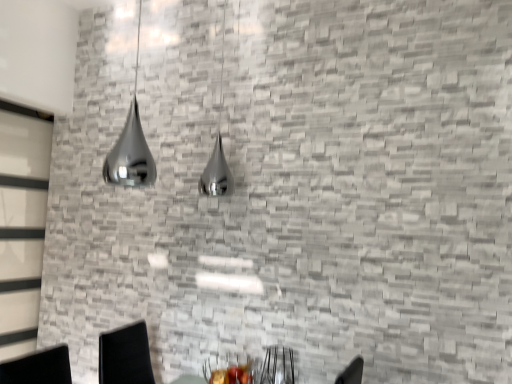
Question: Would you say shiny metallic lamp at upper left contains clear glass door at left?

Choices:
 (A) yes
 (B) no

Answer: (B)

Question: Is shiny metallic lamp at upper left positioned behind clear glass door at left?

Choices:
 (A) yes
 (B) no

Answer: (B)

Question: Are shiny metallic lamp at upper left and clear glass door at left making contact?

Choices:
 (A) yes
 (B) no

Answer: (B)

Question: Is shiny metallic lamp at upper left taller than clear glass door at left?

Choices:
 (A) yes
 (B) no

Answer: (B)

Question: From a real-world perspective, is shiny metallic lamp at upper left physically above clear glass door at left?

Choices:
 (A) yes
 (B) no

Answer: (A)

Question: Is metallic black armchair at lower center bigger or smaller than shiny metallic lamp at upper left?

Choices:
 (A) small
 (B) big

Answer: (A)

Question: In terms of height, does metallic black armchair at lower center look taller or shorter compared to shiny metallic lamp at upper left?

Choices:
 (A) tall
 (B) short

Answer: (B)

Question: Would you say metallic black armchair at lower center is to the left or to the right of shiny metallic lamp at upper left in the picture?

Choices:
 (A) left
 (B) right

Answer: (B)

Question: Which is correct: metallic black armchair at lower center is inside shiny metallic lamp at upper left, or outside of it?

Choices:
 (A) inside
 (B) outside

Answer: (B)

Question: Is clear glass door at left inside the boundaries of shiny metallic lamp at upper left, or outside?

Choices:
 (A) outside
 (B) inside

Answer: (A)

Question: In the image, is clear glass door at left positioned in front of or behind shiny metallic lamp at upper left?

Choices:
 (A) front
 (B) behind

Answer: (B)

Question: In terms of size, does clear glass door at left appear bigger or smaller than shiny metallic lamp at upper left?

Choices:
 (A) small
 (B) big

Answer: (B)

Question: Is point (33, 137) closer or farther from the camera than point (138, 13)?

Choices:
 (A) farther
 (B) closer

Answer: (A)

Question: Considering their positions, is metallic black armchair at lower center located in front of or behind clear glass door at left?

Choices:
 (A) front
 (B) behind

Answer: (A)

Question: Is metallic black armchair at lower center inside or outside of clear glass door at left?

Choices:
 (A) inside
 (B) outside

Answer: (B)